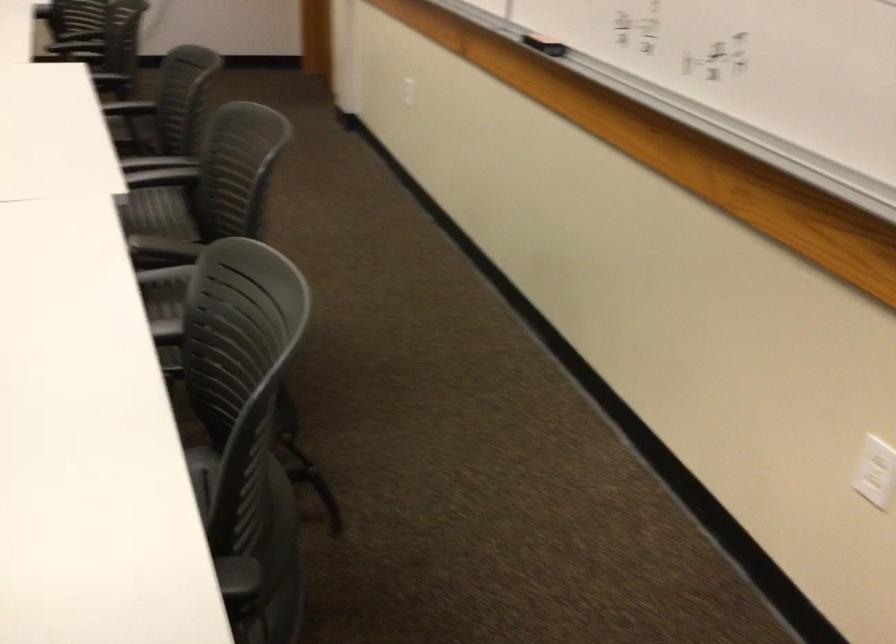
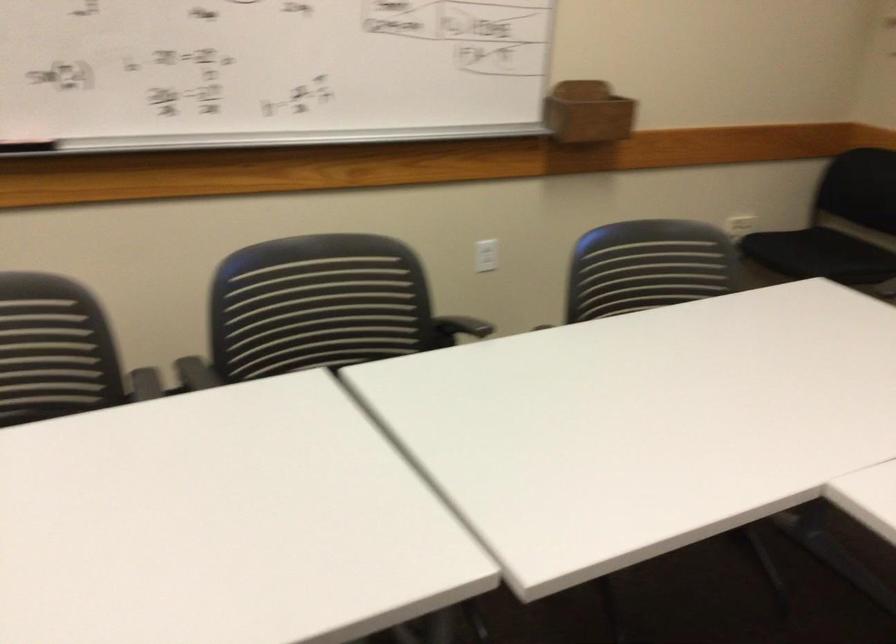
Where in the second image is the point corresponding to (193,252) from the first image?

(458, 328)